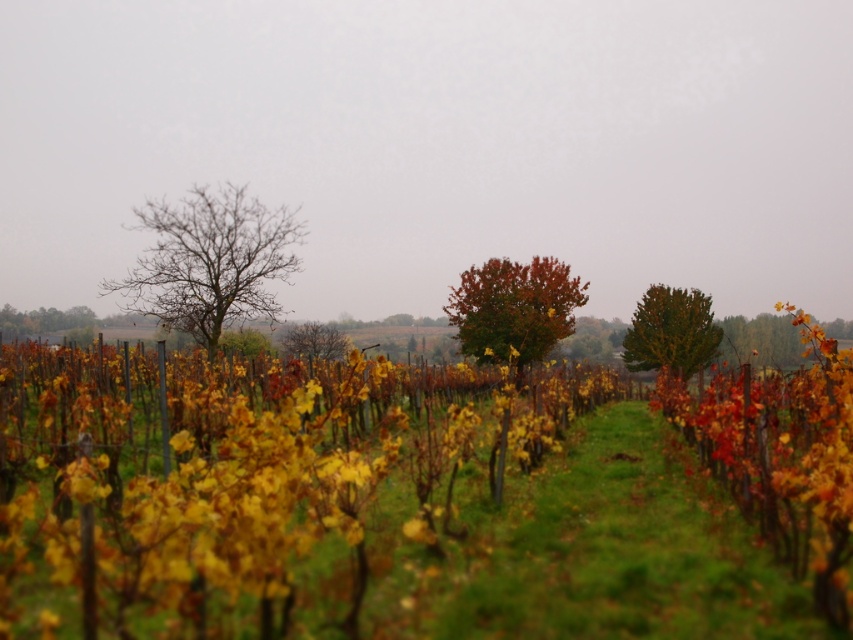
Question: Which of these objects is positioned farthest from the autumn leaves at center?

Choices:
 (A) autumn leaves tree at center
 (B) green leafy tree at right

Answer: (B)

Question: Does bare branches at left lie in front of autumn leaves tree at center?

Choices:
 (A) yes
 (B) no

Answer: (B)

Question: Which of the following is the closest to the observer?

Choices:
 (A) bare branches at left
 (B) autumn leaves tree at center

Answer: (B)

Question: Is green leafy tree at right to the right of autumn leaves at center from the viewer's perspective?

Choices:
 (A) no
 (B) yes

Answer: (B)

Question: Estimate the real-world distances between objects in this image. Which object is farther from the autumn leaves at center?

Choices:
 (A) green matte tree at left
 (B) bare branches at left

Answer: (A)

Question: Where is bare branches at left located in relation to autumn leaves at center in the image?

Choices:
 (A) below
 (B) above

Answer: (B)